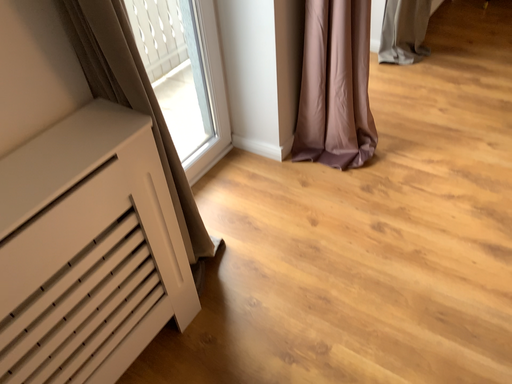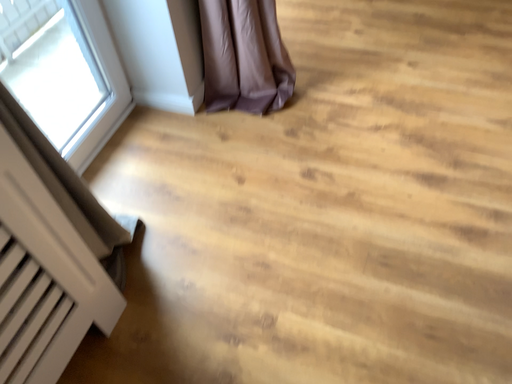
Question: How did the camera likely rotate when shooting the video?

Choices:
 (A) rotated upward
 (B) rotated downward

Answer: (B)